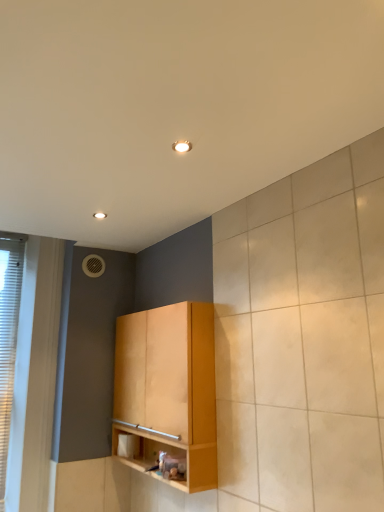
The image size is (384, 512). What do you see at coordinates (8, 336) in the screenshot?
I see `white textured window at left` at bounding box center [8, 336].

Where is `white textured window at left`? white textured window at left is located at coordinates (8, 336).

What is the approximate width of light wood cabinet at center?

light wood cabinet at center is 7.57 inches wide.

Image resolution: width=384 pixels, height=512 pixels. What do you see at coordinates (169, 387) in the screenshot?
I see `light wood cabinet at center` at bounding box center [169, 387].

Where is `light wood cabinet at center`? This screenshot has height=512, width=384. light wood cabinet at center is located at coordinates (169, 387).

Where is `white textured window at left`? This screenshot has width=384, height=512. white textured window at left is located at coordinates (8, 336).

Which is more to the right, white textured window at left or light wood cabinet at center?

light wood cabinet at center.

Considering their positions, is white textured window at left located in front of or behind light wood cabinet at center?

Clearly, white textured window at left is behind light wood cabinet at center.

Considering the positions of point (22, 267) and point (209, 336), is point (22, 267) closer or farther from the camera than point (209, 336)?

Point (22, 267).

From the image's perspective, which object appears higher, white textured window at left or light wood cabinet at center?

white textured window at left is shown above in the image.

Based on the photo, from a real-world perspective, is white textured window at left physically below light wood cabinet at center?

No, from a real-world perspective, white textured window at left is not below light wood cabinet at center.

Between white textured window at left and light wood cabinet at center, which one has smaller width?

Thinner between the two is white textured window at left.

Is white textured window at left shorter than light wood cabinet at center?

No.

Who is bigger, white textured window at left or light wood cabinet at center?

Bigger between the two is light wood cabinet at center.

Would you say white textured window at left is outside light wood cabinet at center?

That's correct, white textured window at left is outside of light wood cabinet at center.

Is white textured window at left next to light wood cabinet at center and touching it?

No, white textured window at left is not beside light wood cabinet at center.

Does white textured window at left turn towards light wood cabinet at center?

No, white textured window at left is not turned towards light wood cabinet at center.

How different are the orientations of white textured window at left and light wood cabinet at center in degrees?

The angular difference between white textured window at left and light wood cabinet at center is 90.2 degrees.

How distant is white textured window at left from light wood cabinet at center?

white textured window at left is 36.35 inches from light wood cabinet at center.

Identify the location of window on the left of the light wood cabinet at center. (8, 336).

Considering the relative positions of light wood cabinet at center and white textured window at left in the image provided, is light wood cabinet at center to the left or to the right of white textured window at left?

light wood cabinet at center is to the right of white textured window at left.

Considering the positions of objects light wood cabinet at center and white textured window at left in the image provided, who is in front, light wood cabinet at center or white textured window at left?

light wood cabinet at center.

Is point (136, 385) more distant than point (6, 341)?

No, (136, 385) is in front of (6, 341).

From the image's perspective, is light wood cabinet at center below white textured window at left?

Correct, light wood cabinet at center appears lower than white textured window at left in the image.

From a real-world perspective, does light wood cabinet at center stand above white textured window at left?

No.

Is light wood cabinet at center wider than white textured window at left?

Correct, the width of light wood cabinet at center exceeds that of white textured window at left.

In the scene shown: Can you confirm if light wood cabinet at center is taller than white textured window at left?

In fact, light wood cabinet at center may be shorter than white textured window at left.

Who is smaller, light wood cabinet at center or white textured window at left?

With smaller size is white textured window at left.

Looking at this image, is white textured window at left a part of light wood cabinet at center?

No, white textured window at left is not surrounded by light wood cabinet at center.

Is light wood cabinet at center far from white textured window at left?

No, light wood cabinet at center is not far from white textured window at left.

Is light wood cabinet at center turned away from white textured window at left?

No, light wood cabinet at center is not facing away from white textured window at left.

Find the location of a particular element. window located on the left of light wood cabinet at center is located at coordinates (8, 336).

Locate an element on the screen. This screenshot has height=512, width=384. cabinetry directly beneath the white textured window at left (from a real-world perspective) is located at coordinates (169, 387).

Where is `window behind the light wood cabinet at center`? window behind the light wood cabinet at center is located at coordinates (8, 336).